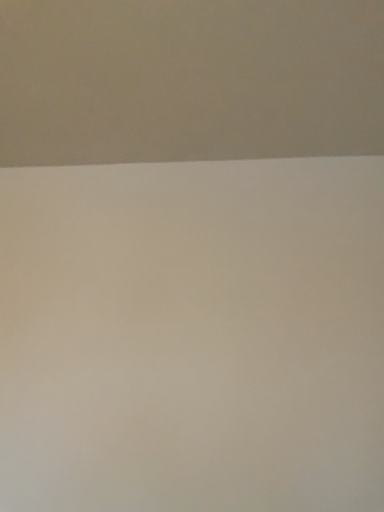
What do you see at coordinates (189, 80) in the screenshot? The image size is (384, 512). I see `smooth beige wall at upper` at bounding box center [189, 80].

This screenshot has height=512, width=384. I want to click on smooth beige wall at upper, so click(x=189, y=80).

Identify the location of smooth beige wall at upper. This screenshot has width=384, height=512. [x=189, y=80].